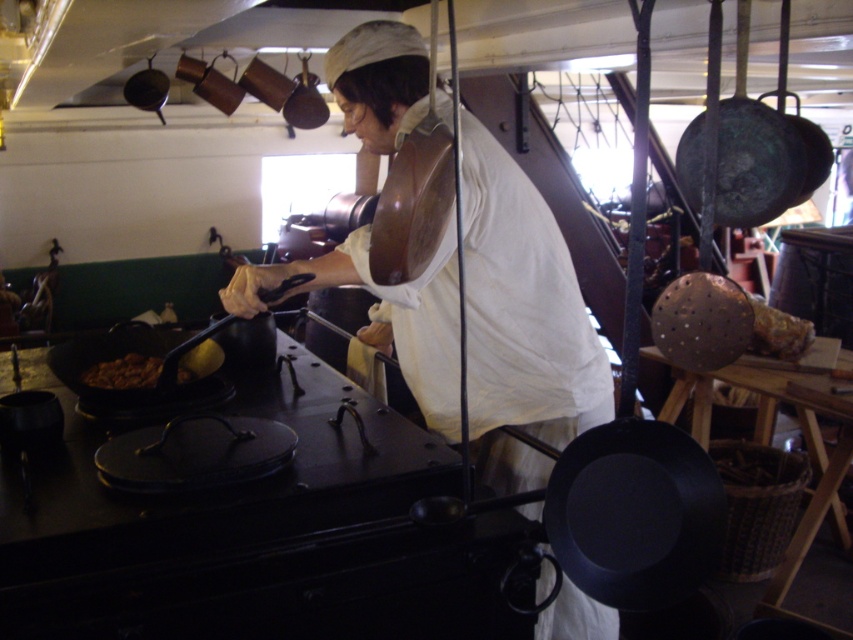
Question: Which object is closer to the camera taking this photo?

Choices:
 (A) brown matte food at center
 (B) shiny copper frying pan at upper left

Answer: (A)

Question: Where is white matte apron at center located in relation to shiny copper frying pan at upper left in the image?

Choices:
 (A) right
 (B) left

Answer: (A)

Question: Which point is closer to the camera taking this photo?

Choices:
 (A) (195, 397)
 (B) (149, 106)

Answer: (A)

Question: Does green patina metal frying pan at upper right have a lesser width compared to brown matte food at center?

Choices:
 (A) yes
 (B) no

Answer: (A)

Question: Which object appears farthest from the camera in this image?

Choices:
 (A) shiny copper frying pan at upper left
 (B) black matte wok at left
 (C) brown matte food at center

Answer: (A)

Question: Is white matte apron at center further to the viewer compared to green patina metal frying pan at upper right?

Choices:
 (A) no
 (B) yes

Answer: (A)